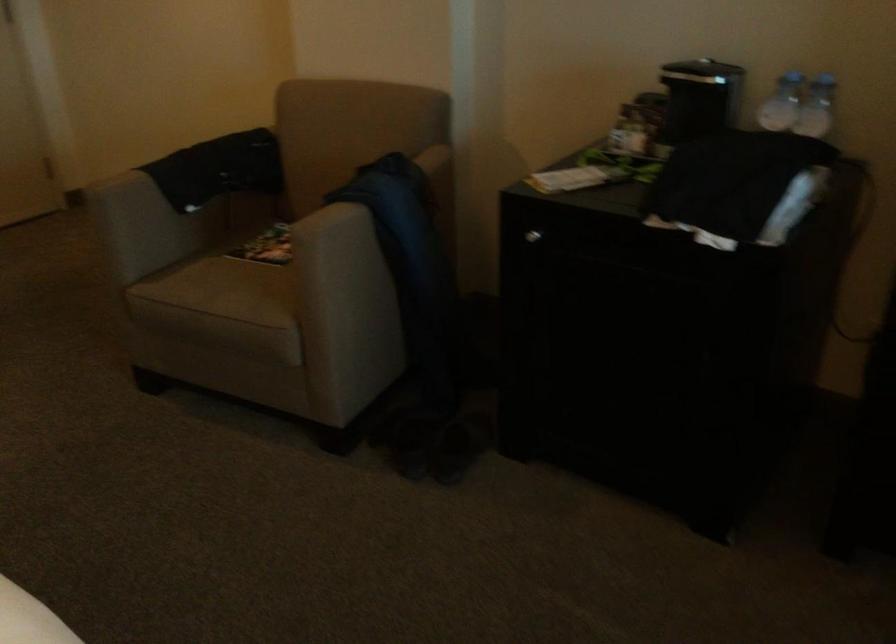
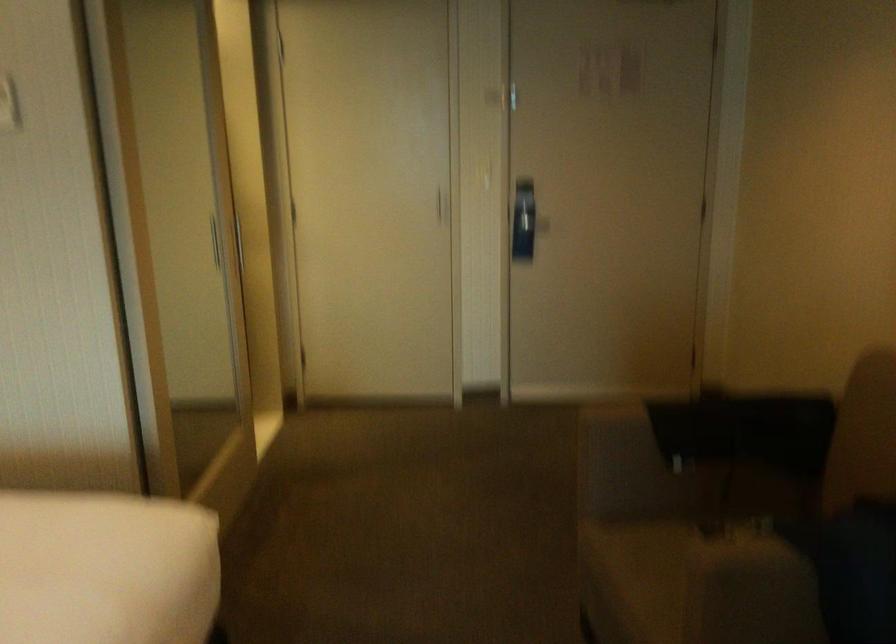
Question: The first image is from the beginning of the video and the second image is from the end. How did the camera likely rotate when shooting the video?

Choices:
 (A) Left
 (B) Right
 (C) Up
 (D) Down

Answer: (A)